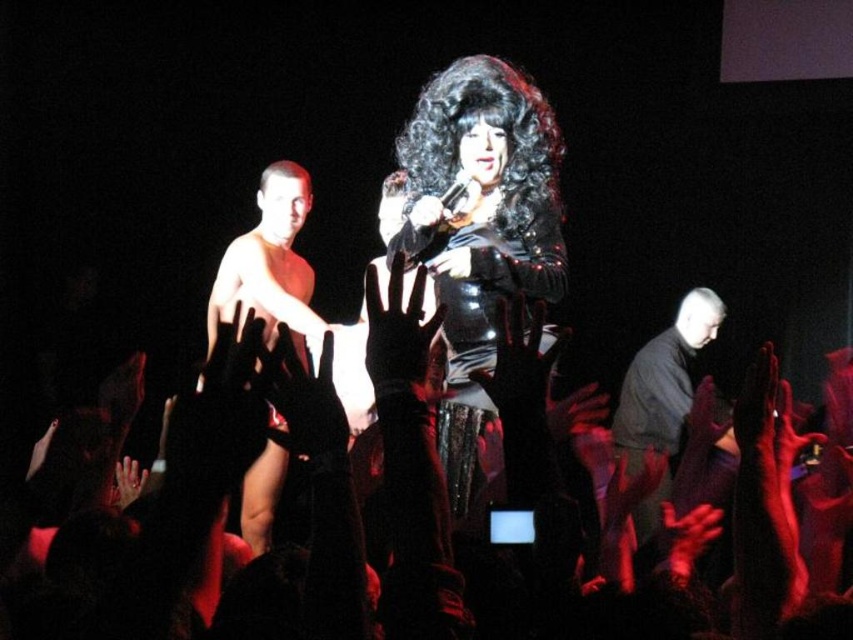
Question: Is shiny skin torso at center to the left of black matte shirt at lower right from the viewer's perspective?

Choices:
 (A) yes
 (B) no

Answer: (A)

Question: Which object appears closest to the camera in this image?

Choices:
 (A) black matte shirt at lower right
 (B) shiny black dress at center
 (C) shiny skin torso at center

Answer: (B)

Question: Can you confirm if shiny skin torso at center is positioned to the right of black matte shirt at lower right?

Choices:
 (A) yes
 (B) no

Answer: (B)

Question: Where is shiny black dress at center located in relation to black matte shirt at lower right in the image?

Choices:
 (A) left
 (B) right

Answer: (A)

Question: Which point is closer to the camera?

Choices:
 (A) (630, 412)
 (B) (254, 292)
 (C) (534, 189)

Answer: (C)

Question: Estimate the real-world distances between objects in this image. Which object is farther from the black matte shirt at lower right?

Choices:
 (A) shiny black dress at center
 (B) shiny skin torso at center

Answer: (A)